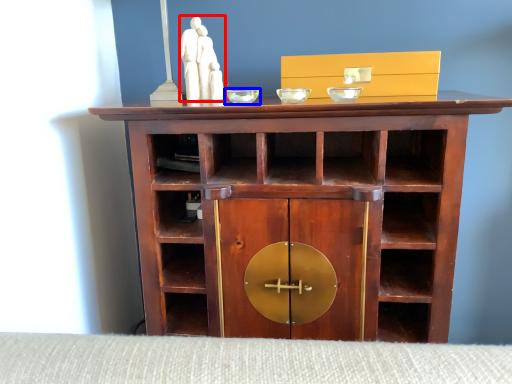
Question: Which of the following is the farthest to the observer, sculpture (highlighted by a red box) or glass bowl (highlighted by a blue box)?

Choices:
 (A) sculpture
 (B) glass bowl

Answer: (A)